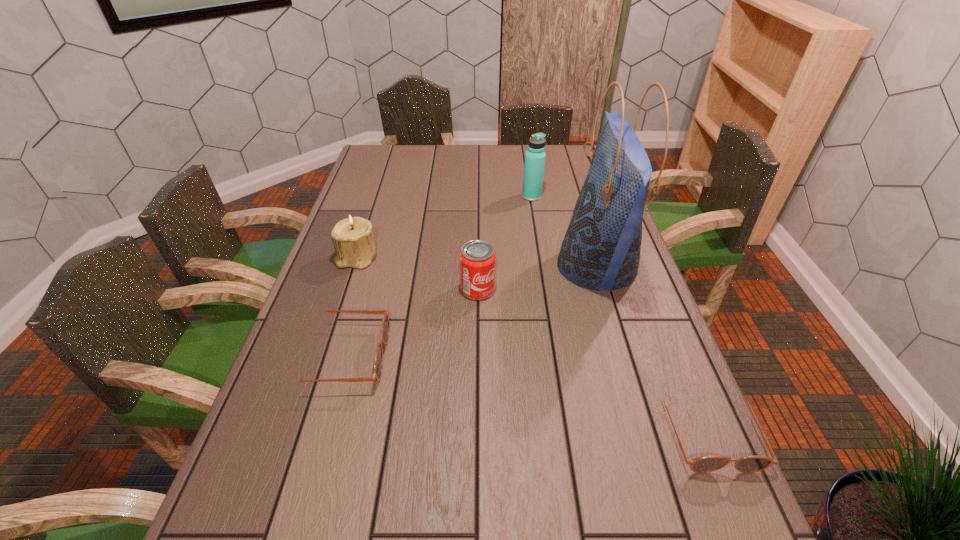
The image size is (960, 540). I want to click on free space located 0.160m on the front-facing side of the farther sunglasses, so click(453, 356).

Locate an element on the screen. The image size is (960, 540). blank space located 0.120m on the back of the tallest object is located at coordinates (580, 210).

Find the location of `free space located on the front of the thermos bottle`. free space located on the front of the thermos bottle is located at coordinates (545, 277).

Where is `free location located on the right of the can`? free location located on the right of the can is located at coordinates (546, 289).

I want to click on vacant space positioned 0.310m on the back of the candle_holder, so click(378, 192).

You are a GUI agent. You are given a task and a screenshot of the screen. Output one action in this format:
    pyautogui.click(x=<x>, y=<y>)
    Task: Click on the object that is at the near edge
    The width and height of the screenshot is (960, 540).
    Given the screenshot: What is the action you would take?
    coord(750,464)

You are a GUI agent. You are given a task and a screenshot of the screen. Output one action in this format:
    pyautogui.click(x=<x>, y=<y>)
    Task: Click on the sunglasses that is at the left edge
    
    Given the screenshot: What is the action you would take?
    pyautogui.click(x=377, y=368)

Image resolution: width=960 pixels, height=540 pixels. I want to click on candle_holder present at the left edge, so click(x=352, y=237).

In order to click on sunglasses located in the right edge section of the desktop in this screenshot , I will do `click(750, 464)`.

This screenshot has width=960, height=540. What are the coordinates of `shopping bag at the right edge` in the screenshot? It's located at (601, 249).